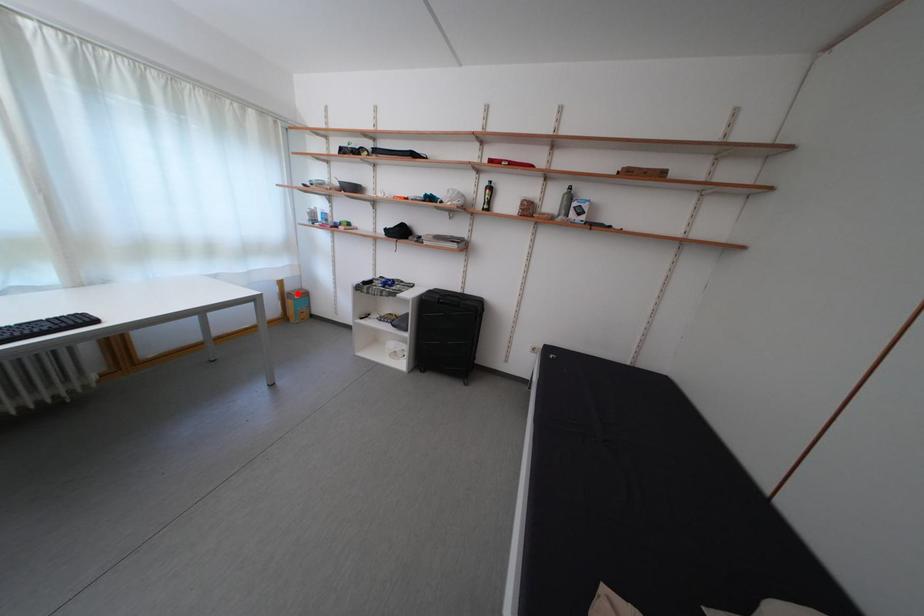
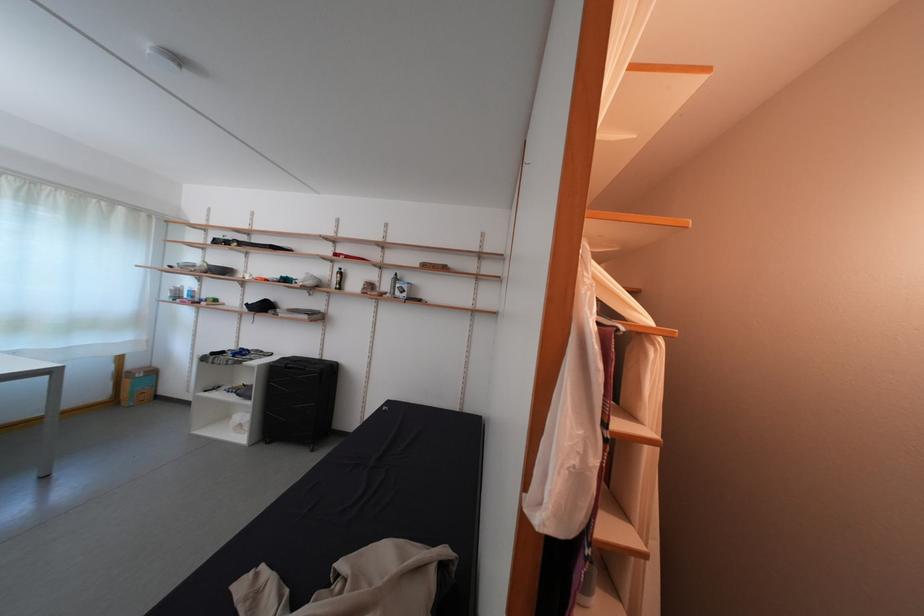
Locate, in the second image, the point that corresponds to the highlighted location in the first image.

(140, 371)